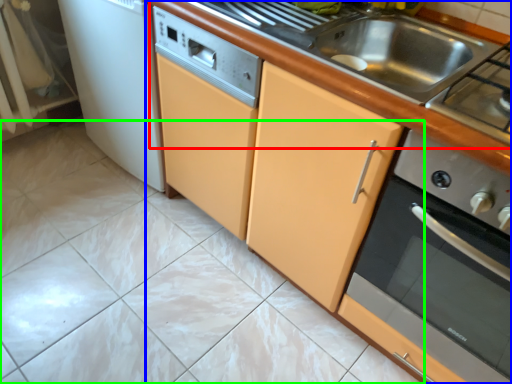
Question: Which object is positioned farthest from counter top (highlighted by a red box)? Select from countertop (highlighted by a blue box) and ceramic tile (highlighted by a green box).

Choices:
 (A) countertop
 (B) ceramic tile

Answer: (B)